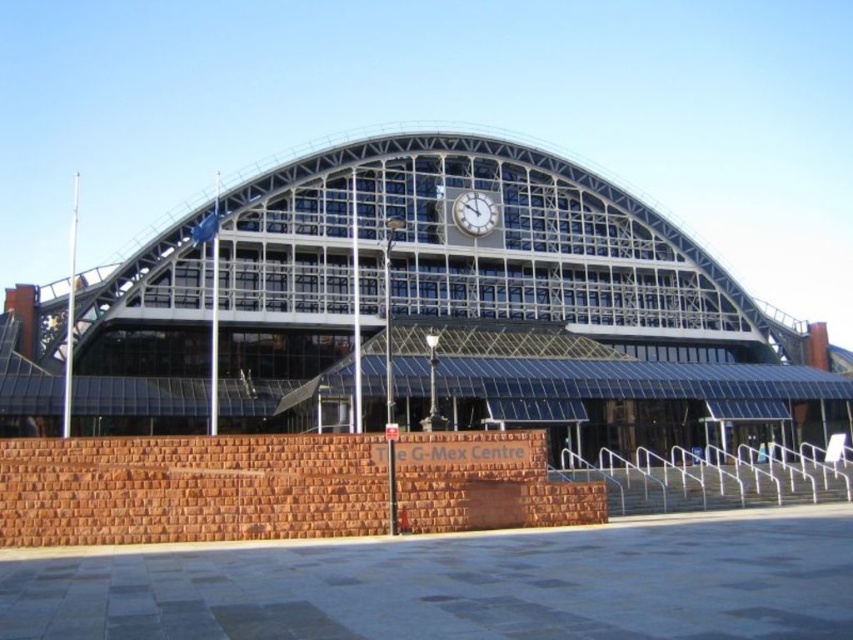
You are a visitor approaching the entrance of the glassy steel railway station at center and the white metallic clock at center. Which object will you see first as you walk towards the building?

The white metallic clock at center will be seen first because the glassy steel railway station at center is positioned to its right, meaning the clock is closer to the front of the building.

You are standing at the entrance of the building and see two points marked on the facade. The first point is located at coordinates point (810, 387) and the second at point (461, 202). Which point is closer to the entrance?

Point (461, 202) is closer to the entrance because it is in front of point (810, 387), which is behind it.